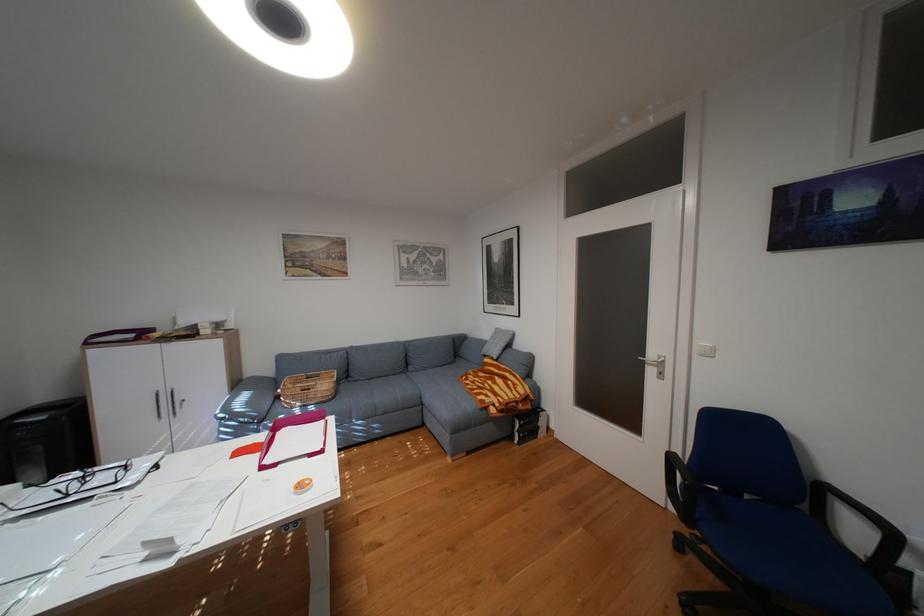
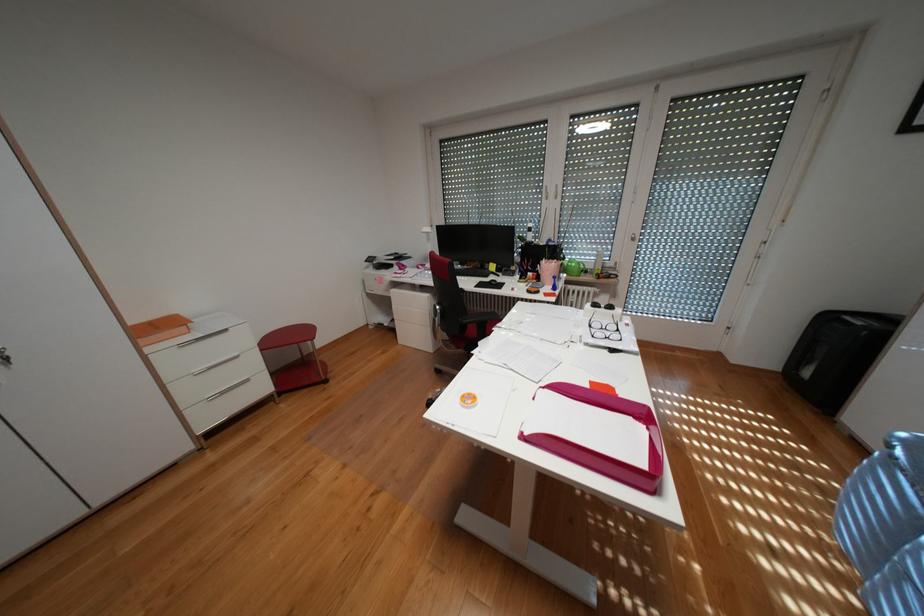
Locate, in the second image, the point that corresponds to pixel 79 495 in the first image.

(602, 325)